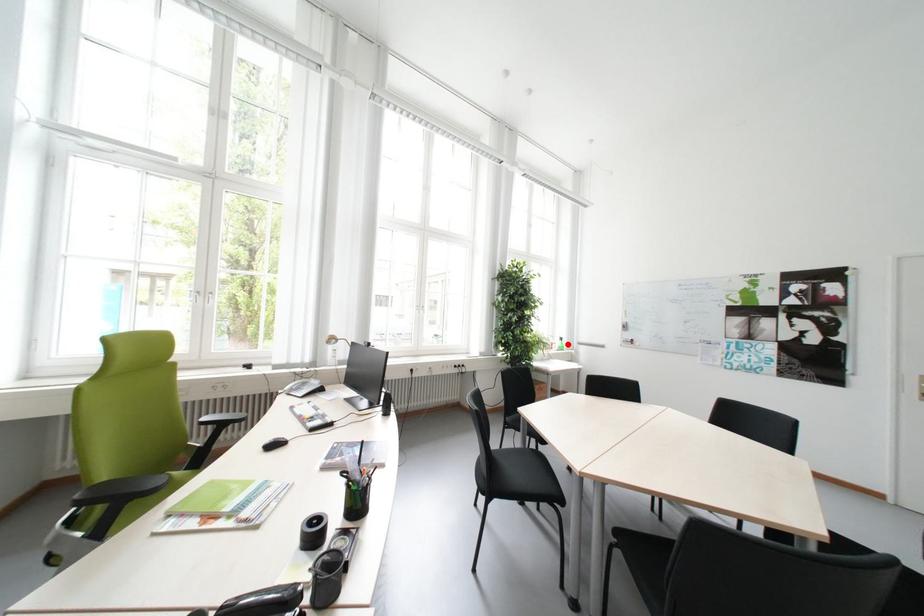
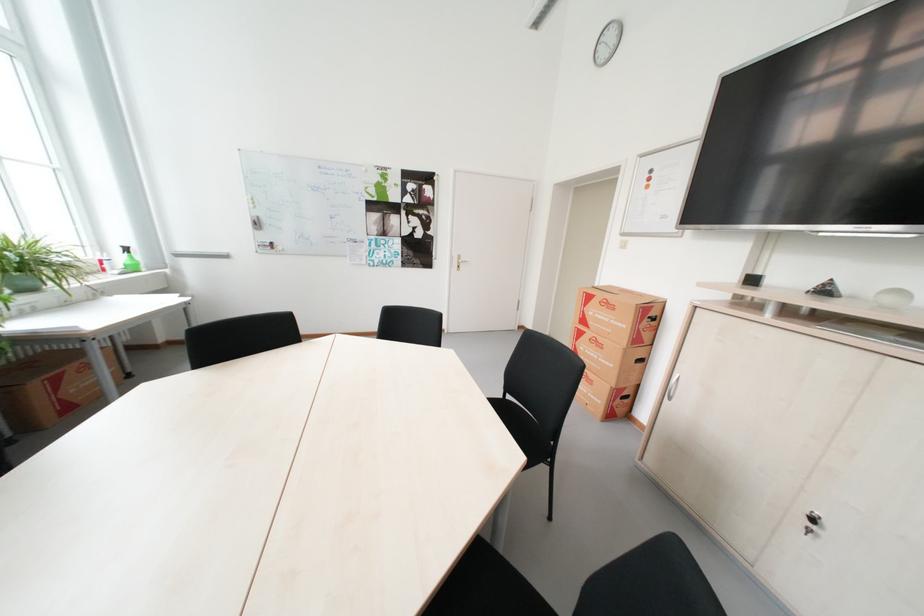
The point at the highlighted location is marked in the first image. Where is the corresponding point in the second image?

(130, 260)